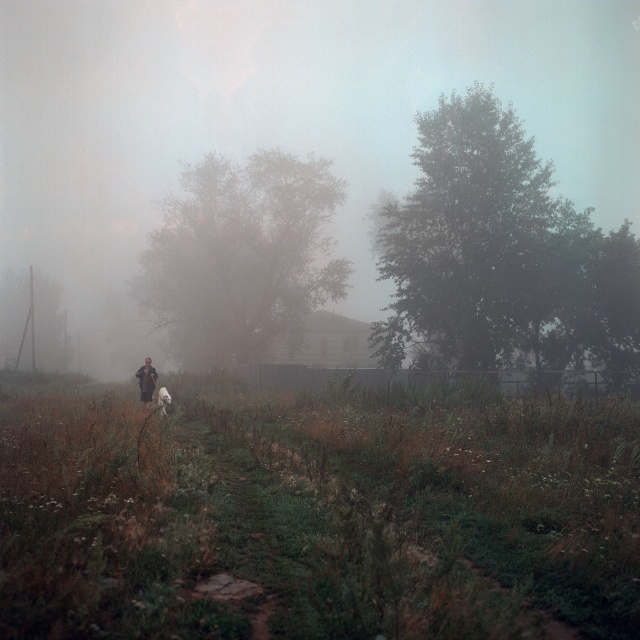
Question: Considering the relative positions of green grassy field at center and white fluffy dog at center in the image provided, where is green grassy field at center located with respect to white fluffy dog at center?

Choices:
 (A) below
 (B) above

Answer: (B)

Question: Which object is farther from the camera taking this photo?

Choices:
 (A) foggy translucent morning fog at center
 (B) dark brown leather jacket at center
 (C) white fluffy dog at center
 (D) green grassy field at center

Answer: (A)

Question: Is foggy translucent morning fog at center bigger than dark brown leather jacket at center?

Choices:
 (A) no
 (B) yes

Answer: (B)

Question: Which object is closer to the camera taking this photo?

Choices:
 (A) foggy translucent morning fog at center
 (B) green grassy field at center

Answer: (B)

Question: Does dark brown leather jacket at center appear over white fluffy dog at center?

Choices:
 (A) yes
 (B) no

Answer: (A)

Question: Which point appears farthest from the camera in this image?

Choices:
 (A) (x=637, y=230)
 (B) (x=170, y=401)
 (C) (x=141, y=396)
 (D) (x=476, y=564)

Answer: (A)